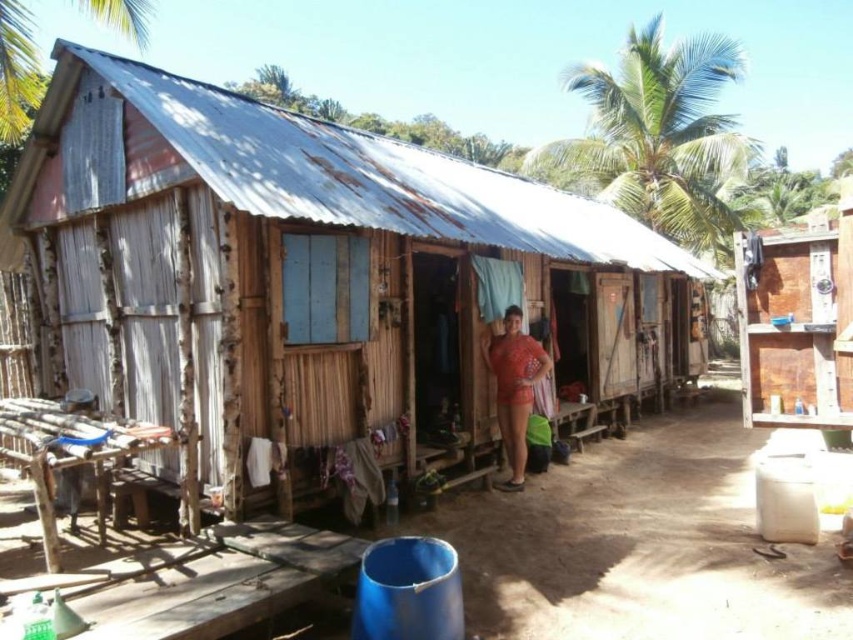
Question: Which is nearer to the green leafy palm tree at upper right?

Choices:
 (A) wooden cabinet at right
 (B) green leafy palm tree at upper center

Answer: (A)

Question: Which of the following is the closest to the observer?

Choices:
 (A) (643, 144)
 (B) (483, 346)
 (C) (785, 227)
 (D) (88, 4)

Answer: (B)

Question: Is green leafy palm tree at upper right positioned behind wooden cabinet at right?

Choices:
 (A) yes
 (B) no

Answer: (A)

Question: Estimate the real-world distances between objects in this image. Which object is farther from the matte red shorts at center?

Choices:
 (A) wooden cabinet at right
 (B) rusty corrugated metal hut at center

Answer: (A)

Question: Is green leafy palm tree at upper right bigger than green leafy palm tree at upper center?

Choices:
 (A) no
 (B) yes

Answer: (B)

Question: Where is green leafy palm tree at upper right located in relation to matte red shorts at center in the image?

Choices:
 (A) above
 (B) below

Answer: (A)